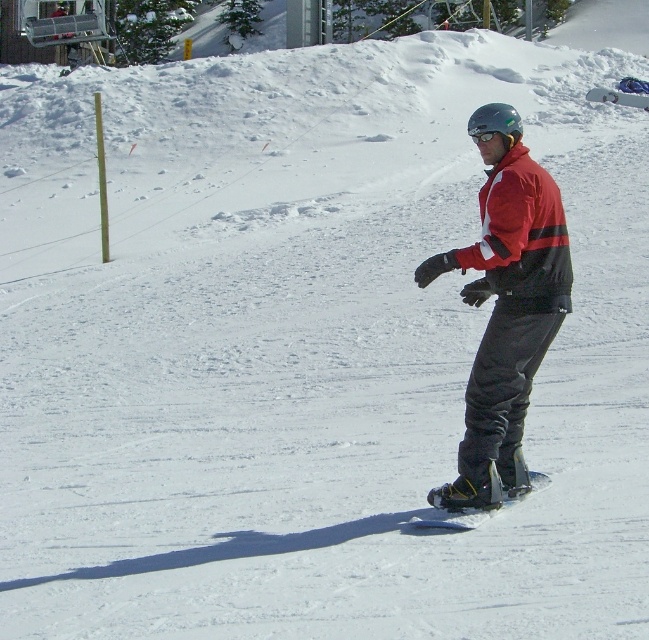
Locate an element on the screen. Image resolution: width=649 pixels, height=640 pixels. red matte jacket at center is located at coordinates (520, 237).

Who is higher up, red matte jacket at center or matte black snowboard at center?

Positioned higher is matte black snowboard at center.

Who is more distant from viewer, [504,262] or [620,99]?

Point [620,99]

I want to click on red matte jacket at center, so click(520, 237).

In order to click on red matte jacket at center in this screenshot , I will do `click(520, 237)`.

How far apart are red matte jacket at center and black matte snowboard at center?

They are 1.26 meters apart.

Between point (487, 243) and point (413, 522), which one is positioned in front?

Positioned in front is point (487, 243).

At what (x,y) coordinates should I click in order to perform the action: click on red matte jacket at center. Please return your answer as a coordinate pair (x, y). Looking at the image, I should click on (520, 237).

Which is behind, point (413, 524) or point (606, 100)?

The point (606, 100) is behind.

Is point (417, 525) closer to viewer compared to point (596, 93)?

Yes, point (417, 525) is closer to viewer.

Locate an element on the screen. The height and width of the screenshot is (640, 649). black matte snowboard at center is located at coordinates (478, 508).